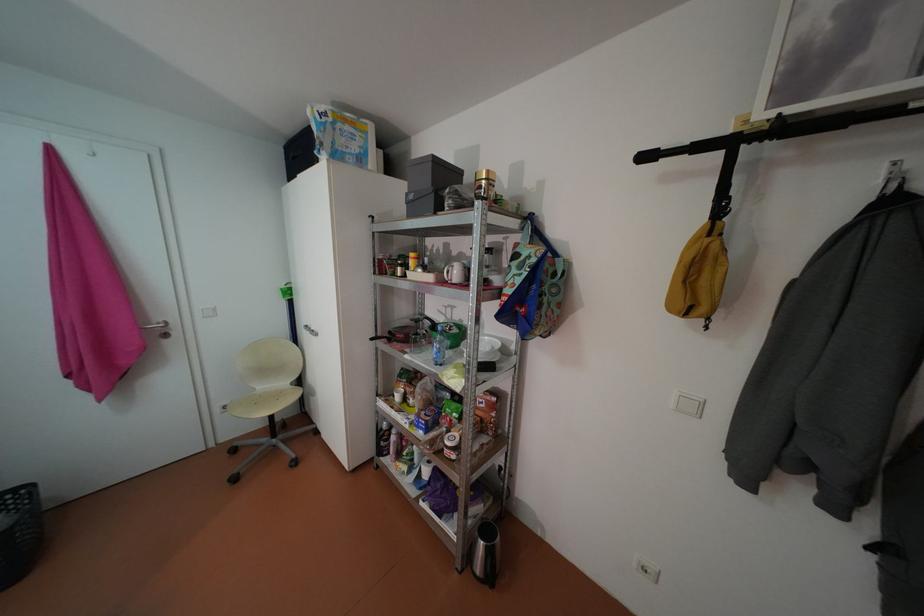
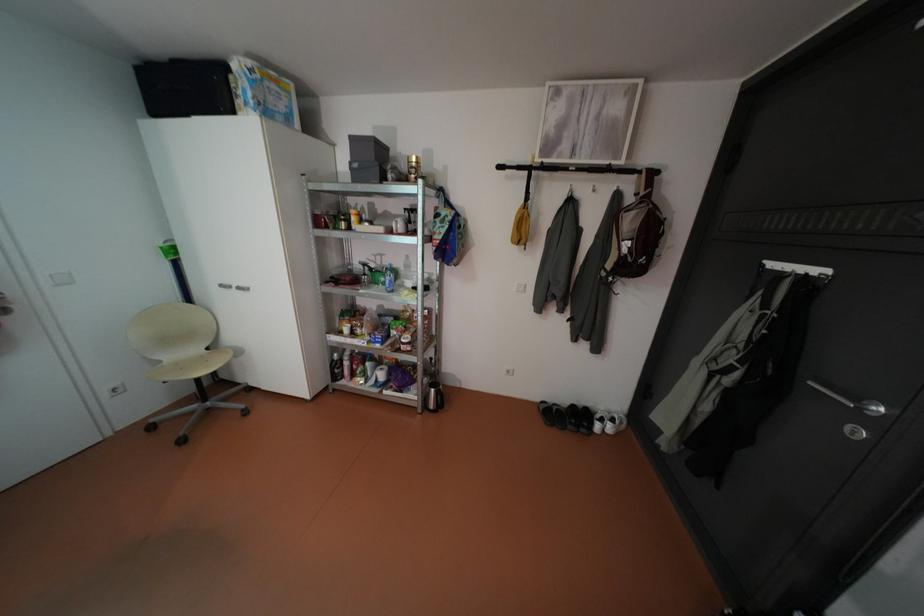
In the second image, find the point that corresponds to the point at 419,196 in the first image.

(365, 164)